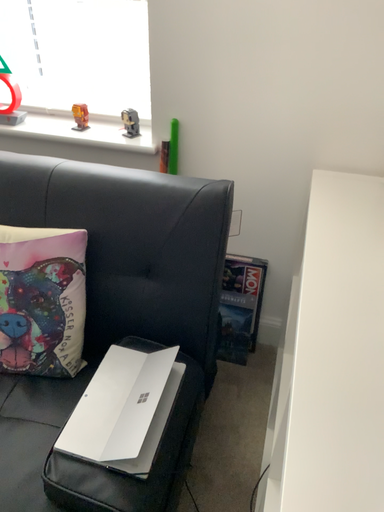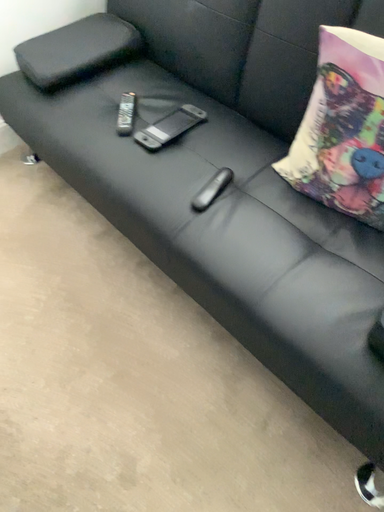
Question: How did the camera likely rotate when shooting the video?

Choices:
 (A) rotated left
 (B) rotated right

Answer: (A)